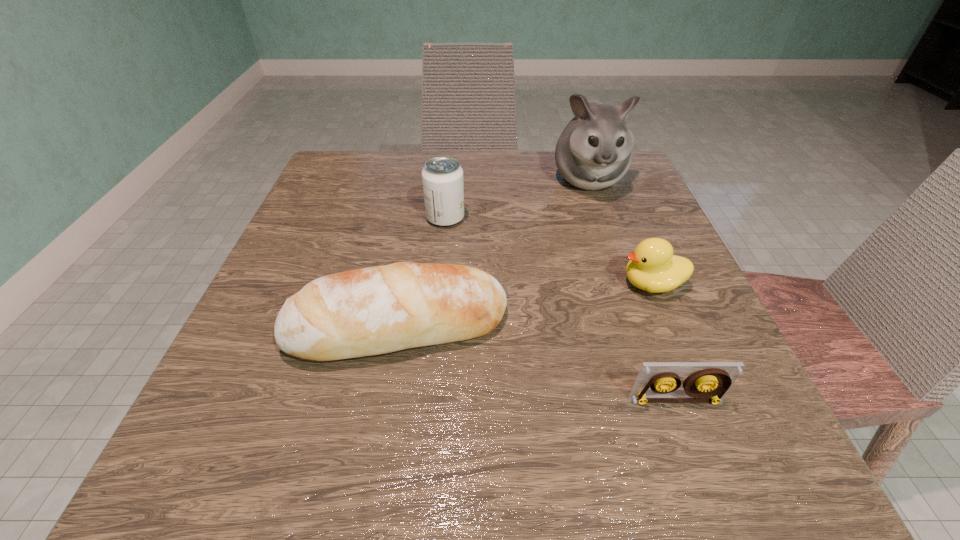
Where is `free space that is in between the duckling and the tallest object`? The width and height of the screenshot is (960, 540). free space that is in between the duckling and the tallest object is located at coordinates (620, 231).

Where is `vacant space that is in between the duckling and the hamster`? vacant space that is in between the duckling and the hamster is located at coordinates (620, 231).

Locate an element on the screen. unoccupied position between the duckling and the soda can is located at coordinates (549, 251).

You are a GUI agent. You are given a task and a screenshot of the screen. Output one action in this format:
    pyautogui.click(x=<x>, y=<y>)
    Task: Click on the free space between the farthest object and the duckling
    The height and width of the screenshot is (540, 960).
    Given the screenshot: What is the action you would take?
    620,231

This screenshot has width=960, height=540. I want to click on vacant point located between the duckling and the videotape, so click(663, 342).

Where is `free space between the duckling and the fourth nearest object`? The height and width of the screenshot is (540, 960). free space between the duckling and the fourth nearest object is located at coordinates (549, 251).

Where is `object that is the third closest to the tallest object`? object that is the third closest to the tallest object is located at coordinates (376, 310).

You are a GUI agent. You are given a task and a screenshot of the screen. Output one action in this format:
    pyautogui.click(x=<x>, y=<y>)
    Task: Click on the object identified as the third closest to the hamster
    The width and height of the screenshot is (960, 540).
    Given the screenshot: What is the action you would take?
    pyautogui.click(x=376, y=310)

Find the location of a particular element. The height and width of the screenshot is (540, 960). free location that satisfies the following two spatial constraints: 1. on the beak of the duckling; 2. at the front of the videotape with visible reels is located at coordinates click(700, 401).